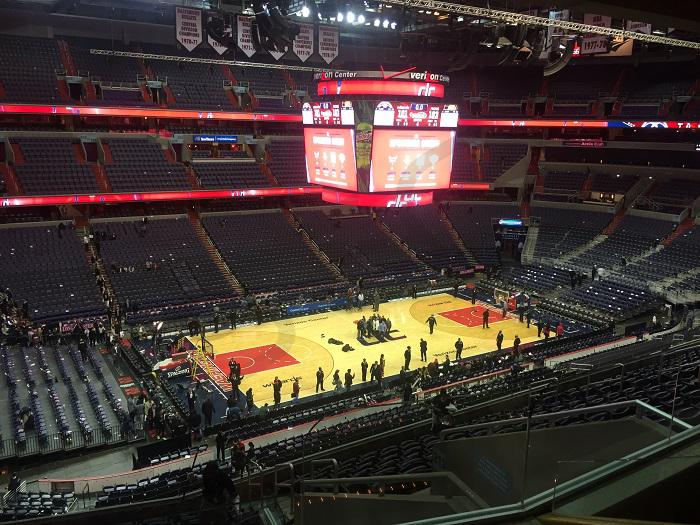
Find the location of `curved screen`. curved screen is located at coordinates (384, 85).